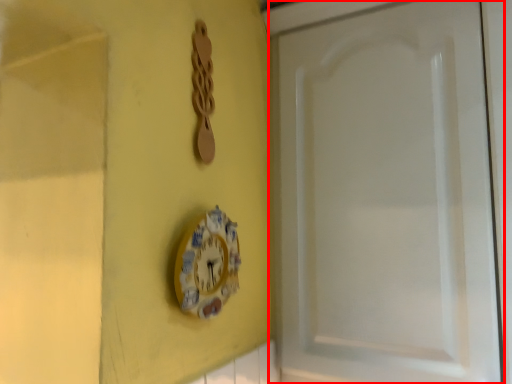
Question: In this image, where is screen door (annotated by the red box) located relative to wall clock?

Choices:
 (A) right
 (B) left

Answer: (A)